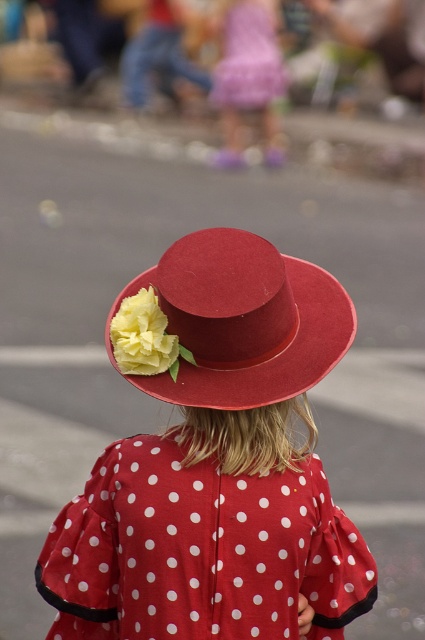
You are a photographer trying to capture the child in the image. You notice both the matte felt hat at center and the matte red hat at center. Which hat is partially blocking the view of the other?

The matte red hat at center is behind matte felt hat at center, so the matte felt hat at center is partially blocking the view of the matte red hat at center.

You are a photographer trying to capture the child in the center of the image. The child is wearing a red dress with a wide brimmed hat. There is a point at coordinates point (218, 467) that marks the location of the matte felt hat. Since the hat is at the center, would you position your camera to focus on the hat to ensure the child is centered?

Yes, since the point (218, 467) marks the location of the matte felt hat at center, focusing on the hat would center the child in the image.